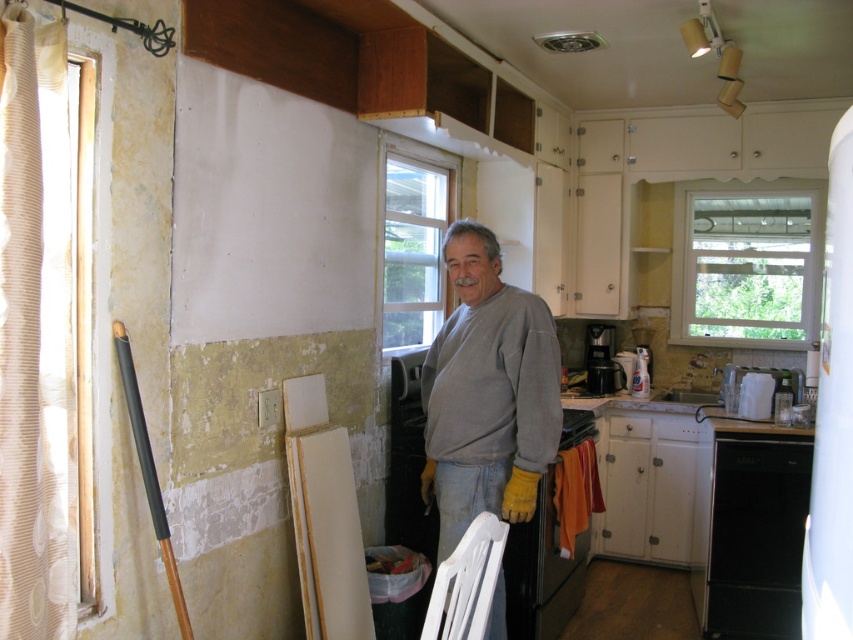
Question: Which object appears farthest from the camera in this image?

Choices:
 (A) black matte dishwasher at lower right
 (B) gray cotton shirt at center

Answer: (A)

Question: Which object is farther from the camera taking this photo?

Choices:
 (A) gray cotton shirt at center
 (B) black matte dishwasher at lower right

Answer: (B)

Question: In this image, where is gray cotton shirt at center located relative to black matte dishwasher at lower right?

Choices:
 (A) left
 (B) right

Answer: (A)

Question: Which point is closer to the camera?

Choices:
 (A) (764, 596)
 (B) (546, 378)

Answer: (B)

Question: Observing the image, what is the correct spatial positioning of gray cotton shirt at center in reference to black matte dishwasher at lower right?

Choices:
 (A) below
 (B) above

Answer: (B)

Question: Is gray cotton shirt at center smaller than black matte dishwasher at lower right?

Choices:
 (A) no
 (B) yes

Answer: (A)